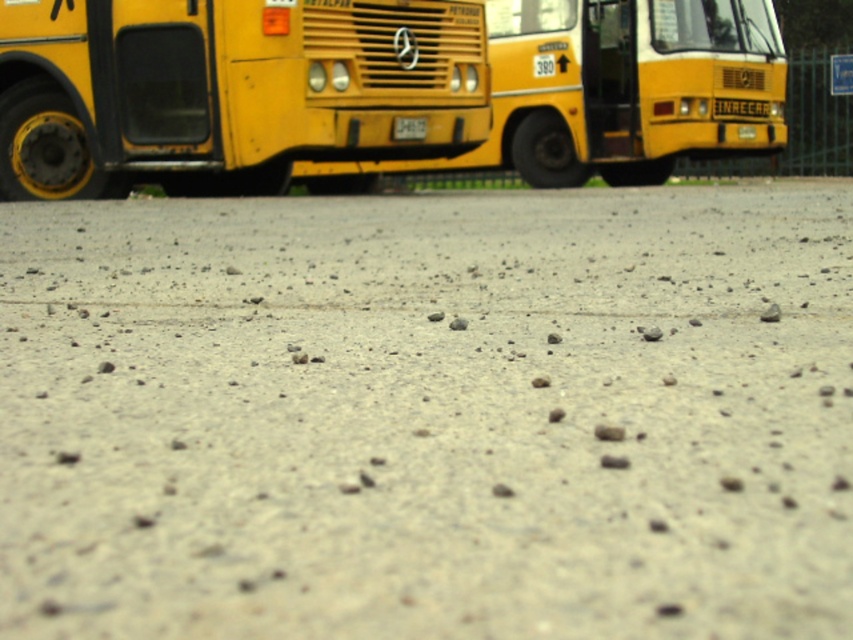
Question: Is metallic yellow bus at left to the left of yellow matte bus at center from the viewer's perspective?

Choices:
 (A) no
 (B) yes

Answer: (B)

Question: Among these objects, which one is farthest from the camera?

Choices:
 (A) metallic yellow bus at left
 (B) yellow matte bus at center

Answer: (B)

Question: Which object is farther from the camera taking this photo?

Choices:
 (A) yellow matte bus at center
 (B) metallic yellow bus at left

Answer: (A)

Question: Which of the following is the farthest from the observer?

Choices:
 (A) yellow matte bus at center
 (B) metallic yellow bus at left

Answer: (A)

Question: Does metallic yellow bus at left have a smaller size compared to yellow matte bus at center?

Choices:
 (A) yes
 (B) no

Answer: (A)

Question: Can you confirm if metallic yellow bus at left is positioned to the left of yellow matte bus at center?

Choices:
 (A) no
 (B) yes

Answer: (B)